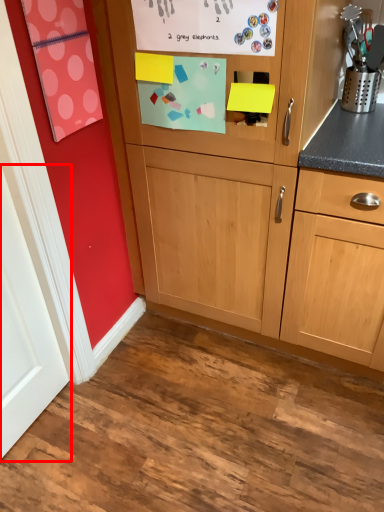
Question: Considering the relative positions of door (annotated by the red box) and cabinetry in the image provided, where is door (annotated by the red box) located with respect to the staircase?

Choices:
 (A) left
 (B) right

Answer: (A)